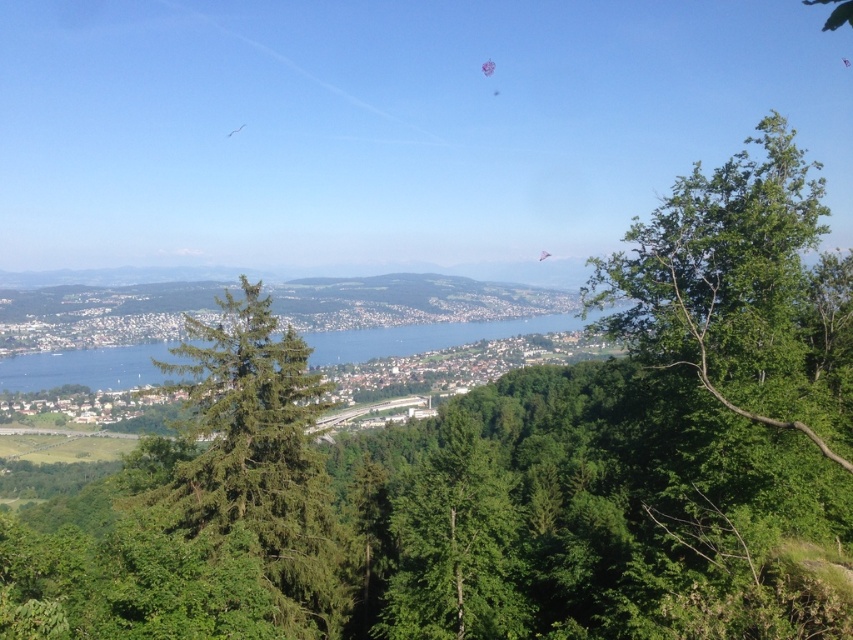
Question: Can you confirm if green needle-like tree at center is positioned below green leafy tree at center?

Choices:
 (A) no
 (B) yes

Answer: (A)

Question: Is the position of green needle-like tree at center less distant than that of green leafy tree at center?

Choices:
 (A) no
 (B) yes

Answer: (B)

Question: Which of the following is the farthest from the observer?

Choices:
 (A) green needle-like tree at center
 (B) green leafy tree at center

Answer: (B)

Question: Which point is closer to the camera?

Choices:
 (A) green leafy tree at center
 (B) green needle-like tree at center

Answer: (B)

Question: Where is green needle-like tree at center located in relation to green leafy tree at center in the image?

Choices:
 (A) left
 (B) right

Answer: (A)

Question: Which point is farther to the camera?

Choices:
 (A) (517, 600)
 (B) (192, 376)

Answer: (B)